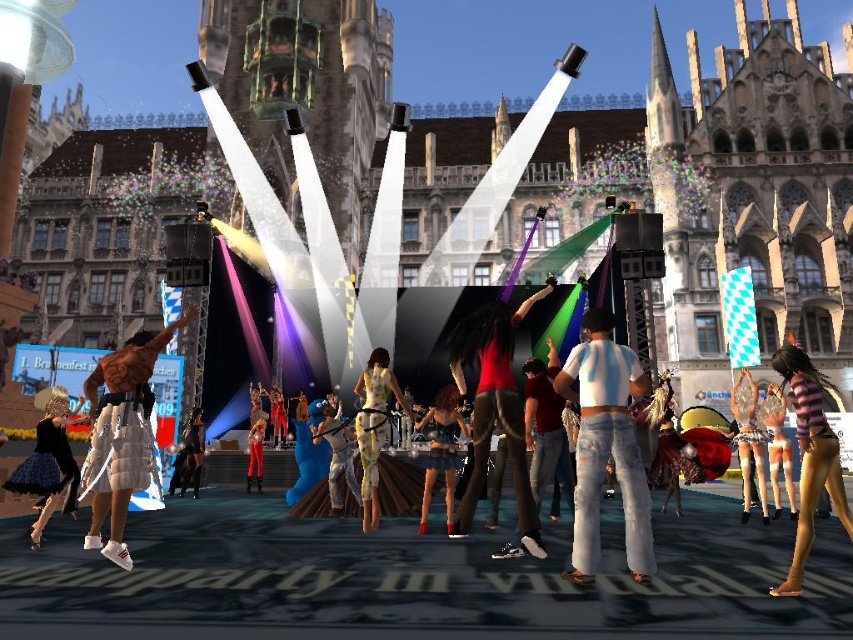
You are a virtual attendee at this event and want to move from your current position to the stage. You notice two points marked on the ground. The first point is at coordinate point (614, 355), and the second is at point (450, 413). Which point should you walk towards to reach the stage more quickly?

You should walk towards point (614, 355) because it is closer to the viewer than point (450, 413), so it is nearer to your current position and thus quicker to reach.